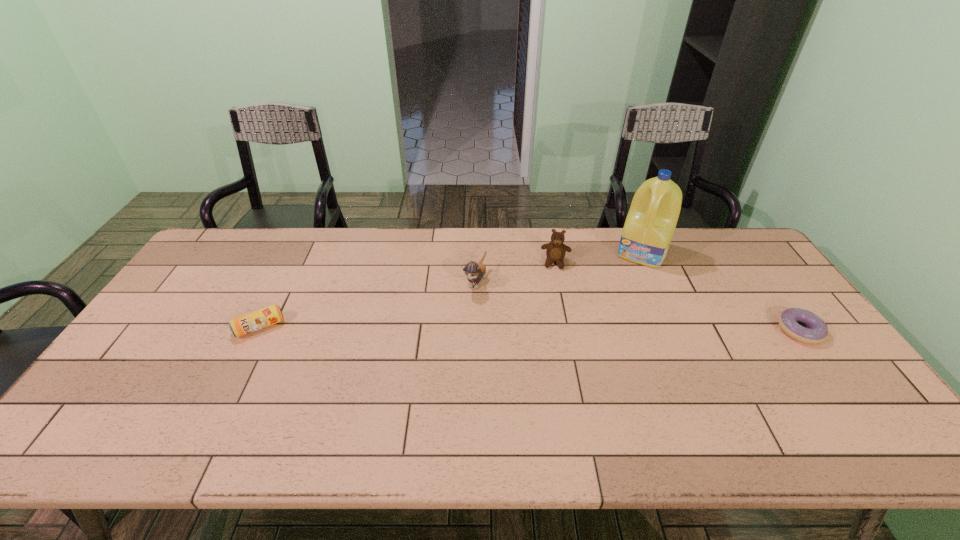
Locate an element on the screen. The image size is (960, 540). vacant space located on the label of the detergent is located at coordinates 622,296.

Image resolution: width=960 pixels, height=540 pixels. What are the coordinates of `vacant position located 0.070m on the label of the detergent` in the screenshot? It's located at pyautogui.click(x=630, y=279).

The image size is (960, 540). In order to click on vacant space situated on the label of the detergent in this screenshot , I will do `click(604, 338)`.

Find the location of a particular element. The image size is (960, 540). free space located on the front-facing side of the second object from left to right is located at coordinates (441, 352).

Identify the location of vacant space positioned on the front-facing side of the second object from left to right. (449, 336).

Find the location of `vacant space located on the front-facing side of the second object from left to right`. vacant space located on the front-facing side of the second object from left to right is located at coordinates (450, 333).

At what (x,y) coordinates should I click in order to perform the action: click on vacant space located 0.240m at the face of the teddy bear. Please return your answer as a coordinate pair (x, y). The width and height of the screenshot is (960, 540). Looking at the image, I should click on (550, 324).

The image size is (960, 540). I want to click on blank space located at the face of the teddy bear, so click(x=550, y=324).

The height and width of the screenshot is (540, 960). Identify the location of vacant area situated at the face of the teddy bear. (551, 305).

Find the location of `detergent that is at the far edge`. detergent that is at the far edge is located at coordinates (651, 221).